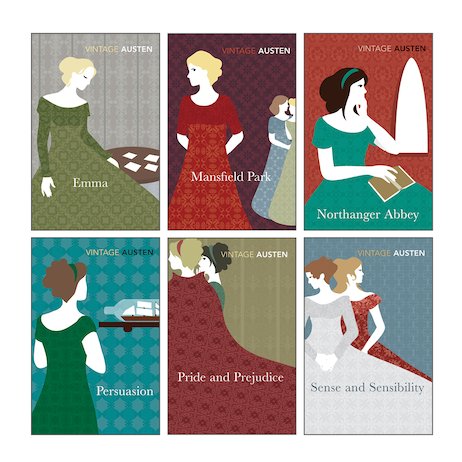
Identify the location of wall. This screenshot has width=462, height=462. click(128, 343), click(267, 311), click(408, 287), click(380, 69), click(250, 105), click(130, 94).